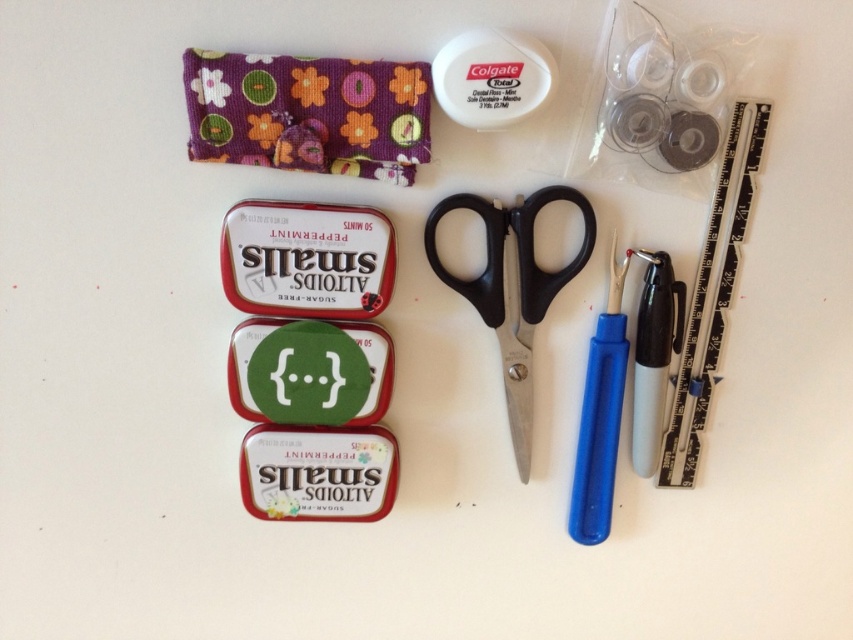
Is black plastic scissors at center positioned at the back of blue plastic needle at right?

No.

Does black plastic scissors at center have a larger size compared to blue plastic needle at right?

Correct, black plastic scissors at center is larger in size than blue plastic needle at right.

Who is more distant from viewer, (529,323) or (592,369)?

The point (592,369) is more distant.

Where is `black plastic scissors at center`? This screenshot has width=853, height=640. black plastic scissors at center is located at coordinates (512, 289).

Does black plastic ruler at upper right appear over blue plastic needle at right?

Correct, black plastic ruler at upper right is located above blue plastic needle at right.

Which of these two, black plastic ruler at upper right or blue plastic needle at right, stands taller?

With more height is black plastic ruler at upper right.

Who is more distant from viewer, [698,307] or [595,490]?

Positioned behind is point [595,490].

Where is `black plastic ruler at upper right`? black plastic ruler at upper right is located at coordinates (712, 292).

Is black plastic scissors at center thinner than black plastic ruler at upper right?

No, black plastic scissors at center is not thinner than black plastic ruler at upper right.

What do you see at coordinates (512, 289) in the screenshot? The image size is (853, 640). I see `black plastic scissors at center` at bounding box center [512, 289].

Where is `black plastic scissors at center`? This screenshot has height=640, width=853. black plastic scissors at center is located at coordinates (512, 289).